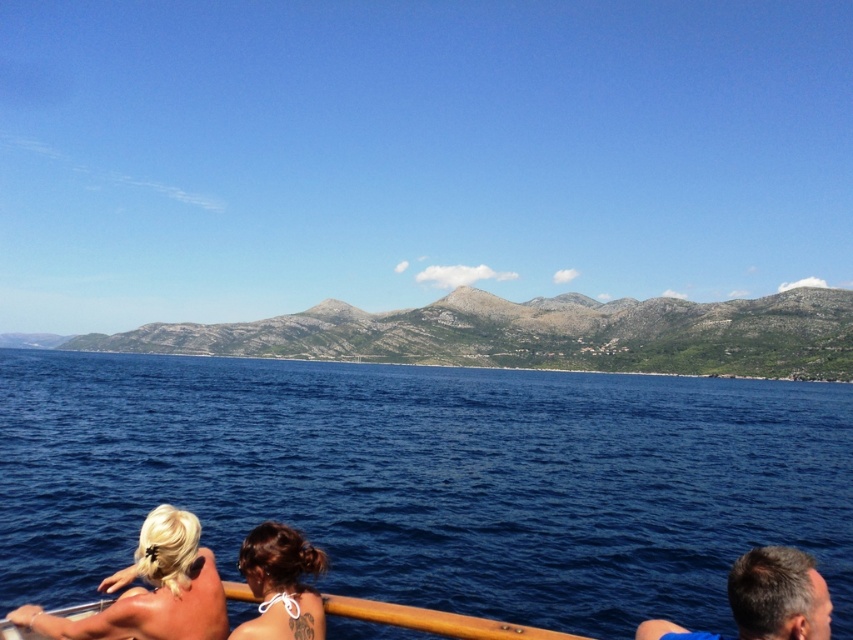
Looking at this image, you are standing on the deck of a boat and want to take a photo of the dark brown hair at lower center without the deep blue water at center appearing in the background. Is this possible based on their positions?

The deep blue water at center is further to the viewer than the dark brown hair at lower center, so the dark brown hair at lower center would be in front of the deep blue water at center. Therefore, taking a photo of the dark brown hair at lower center would include the deep blue water at center in the background.

You are standing on the deck of the boat and want to wave to the person with the blonde hair at lower left. Which direction should you face relative to the dark brown hair at lower center?

You should face towards the lower direction relative to the dark brown hair at lower center because the blonde hair at lower left is located below it.

You are standing on the deck of the boat looking out at the seascape. There are two points marked on the deck. One is at coordinates point (354,568) and the other at point (123,605). If you want to reach the point that is farther away from you, which coordinate should you head towards?

You should head towards point (354,568) because it is behind point (123,605), meaning it is farther away from your current position on the deck.